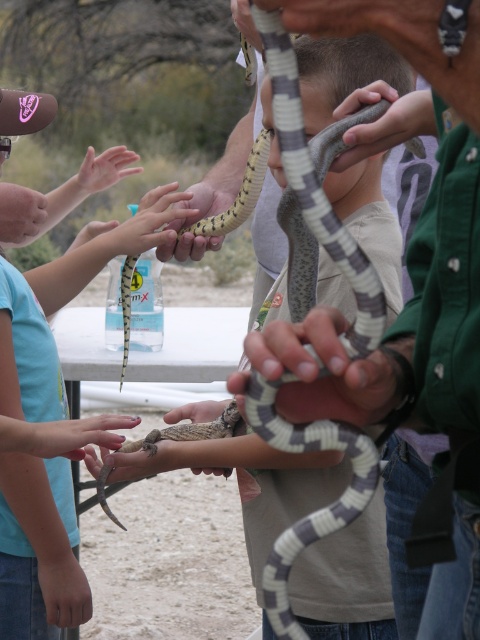
Does point (252, 548) come closer to viewer compared to point (193, 408)?

Yes, point (252, 548) is in front of point (193, 408).

Can you confirm if gray and white striped snake at center is thinner than smooth skin hand at center?

In fact, gray and white striped snake at center might be wider than smooth skin hand at center.

I want to click on gray and white striped snake at center, so click(349, 186).

Locate an element on the screen. The image size is (480, 640). smooth tan snake at center is located at coordinates (62, 305).

Is smooth tan snake at center taller than smooth skin hand at center?

Yes, smooth tan snake at center is taller than smooth skin hand at center.

This screenshot has width=480, height=640. Find the location of `smooth tan snake at center`. smooth tan snake at center is located at coordinates (62, 305).

Who is higher up, gray and white striped snake at center or smooth tan snake at center?

gray and white striped snake at center is above.

Is point (279, 161) less distant than point (43, 504)?

Yes, point (279, 161) is in front of point (43, 504).

At what (x,y) coordinates should I click in order to perform the action: click on gray and white striped snake at center. Please return your answer as a coordinate pair (x, y). The image size is (480, 640). Looking at the image, I should click on (349, 186).